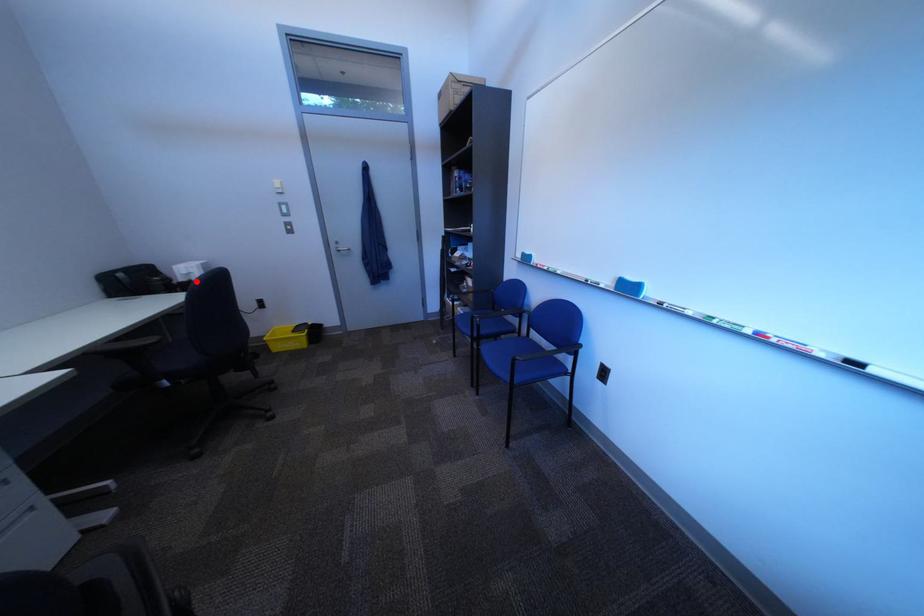
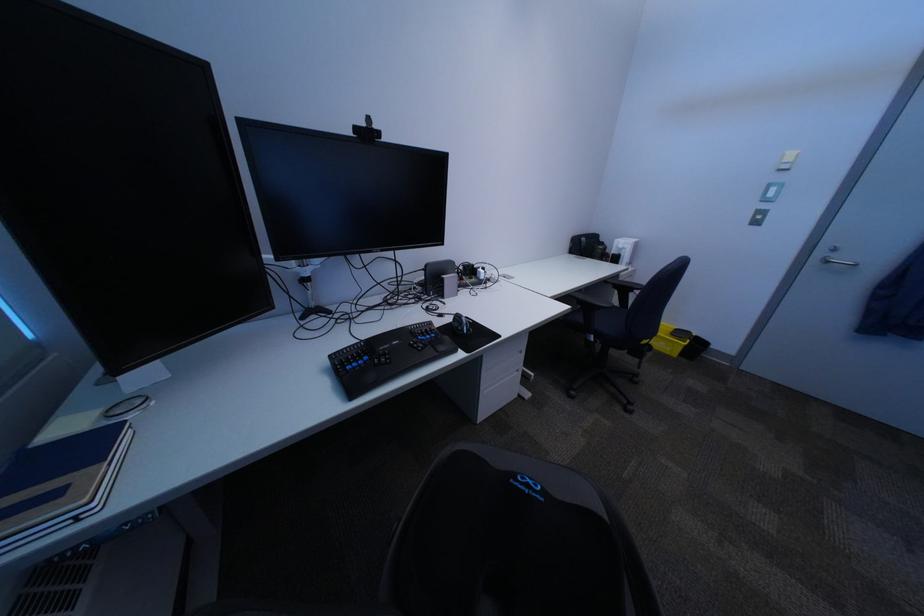
Where in the second image is the point corresponding to the highlighted location from the first image?

(628, 254)